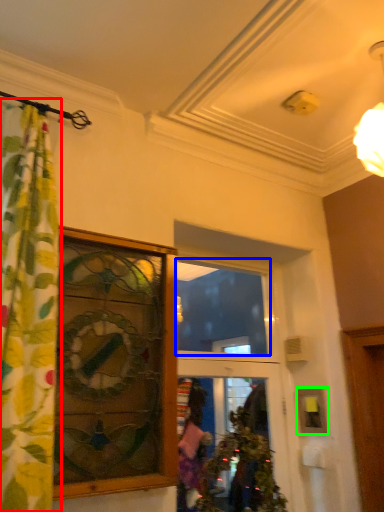
Question: Which is nearer to the curtain (highlighted by a red box)? glass window (highlighted by a blue box) or picture frame (highlighted by a green box).

Choices:
 (A) glass window
 (B) picture frame

Answer: (B)